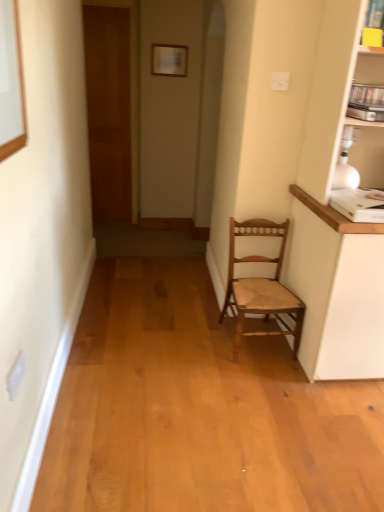
Image resolution: width=384 pixels, height=512 pixels. What do you see at coordinates (109, 110) in the screenshot?
I see `wooden door at left` at bounding box center [109, 110].

I want to click on wooden chair at center, so pyautogui.click(x=261, y=286).

The height and width of the screenshot is (512, 384). In order to click on chair located on the right of wooden door at left in this screenshot , I will do `click(261, 286)`.

From the image's perspective, is wooden chair at center located above or below wooden door at left?

From the image's perspective, wooden chair at center appears below wooden door at left.

Does wooden chair at center have a smaller size compared to wooden door at left?

Incorrect, wooden chair at center is not smaller in size than wooden door at left.

Considering the positions of points (229, 295) and (102, 49), is point (229, 295) closer to camera compared to point (102, 49)?

Yes.

Is matte white picture frame at upper center positioned far away from wooden chair at center?

Yes, matte white picture frame at upper center and wooden chair at center are located far from each other.

Considering their positions, is matte white picture frame at upper center located in front of or behind wooden chair at center?

In the image, matte white picture frame at upper center appears behind wooden chair at center.

Is matte white picture frame at upper center turned away from wooden chair at center?

No.

Which is more to the right, wooden door at left or wooden chair at center?

Positioned to the right is wooden chair at center.

Is wooden door at left turned away from wooden chair at center?

wooden door at left is not turned away from wooden chair at center.

How different are the orientations of wooden door at left and wooden chair at center in degrees?

0.347 degrees.

Can you see wooden door at left touching wooden chair at center?

No, wooden door at left is not beside wooden chair at center.

Is matte white picture frame at upper center wider than wooden door at left?

Incorrect, the width of matte white picture frame at upper center does not surpass that of wooden door at left.

Which is behind, matte white picture frame at upper center or wooden door at left?

wooden door at left.

Would you consider matte white picture frame at upper center to be distant from wooden door at left?

That's not correct — matte white picture frame at upper center is a little close to wooden door at left.

In terms of height, does matte white picture frame at upper center look taller or shorter compared to wooden door at left?

Clearly, matte white picture frame at upper center is shorter compared to wooden door at left.

Are wooden door at left and matte white picture frame at upper center making contact?

No.

Consider the image. Does wooden door at left have a smaller size compared to matte white picture frame at upper center?

Actually, wooden door at left might be larger than matte white picture frame at upper center.

Is wooden door at left positioned in front of matte white picture frame at upper center?

No, wooden door at left is further to the viewer.

From the image's perspective, is wooden door at left positioned above or below matte white picture frame at upper center?

Clearly, from the image's perspective, wooden door at left is below matte white picture frame at upper center.

In the image, is wooden chair at center on the left side or the right side of matte white picture frame at upper center?

wooden chair at center is to the right of matte white picture frame at upper center.

Looking at this image, from the image's perspective, is wooden chair at center under matte white picture frame at upper center?

Yes.

Is wooden chair at center far away from matte white picture frame at upper center?

Yes.

Is wooden chair at center in front of or behind matte white picture frame at upper center in the image?

Visually, wooden chair at center is located in front of matte white picture frame at upper center.

Locate an element on the screen. The image size is (384, 512). door on the left side of wooden chair at center is located at coordinates (109, 110).

At what (x,y) coordinates should I click in order to perform the action: click on chair lying in front of the matte white picture frame at upper center. Please return your answer as a coordinate pair (x, y). Image resolution: width=384 pixels, height=512 pixels. Looking at the image, I should click on (261, 286).

From the picture: Based on their spatial positions, is matte white picture frame at upper center or wooden door at left closer to wooden chair at center?

matte white picture frame at upper center.

Looking at the image, which one is located further to wooden chair at center, wooden door at left or matte white picture frame at upper center?

wooden door at left lies further to wooden chair at center than the other object.

Which object lies nearer to the anchor point wooden door at left, matte white picture frame at upper center or wooden chair at center?

matte white picture frame at upper center is closer to wooden door at left.

Based on the photo, when comparing their distances from wooden door at left, does wooden chair at center or matte white picture frame at upper center seem further?

Among the two, wooden chair at center is located further to wooden door at left.

Based on the photo, estimate the real-world distances between objects in this image. Which object is closer to matte white picture frame at upper center, wooden chair at center or wooden door at left?

Among the two, wooden door at left is located nearer to matte white picture frame at upper center.

Looking at the image, which one is located closer to matte white picture frame at upper center, wooden door at left or wooden chair at center?

Among the two, wooden door at left is located nearer to matte white picture frame at upper center.

You are a GUI agent. You are given a task and a screenshot of the screen. Output one action in this format:
    pyautogui.click(x=<x>, y=<y>)
    Task: Click on the picture frame between wooden chair at center and wooden door at left from front to back
    The height and width of the screenshot is (512, 384).
    Given the screenshot: What is the action you would take?
    pyautogui.click(x=169, y=60)